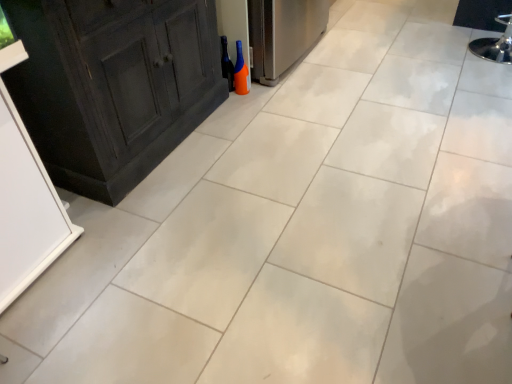
This screenshot has width=512, height=384. Identify the location of vacant region in front of orange matte bottle at center. (241, 99).